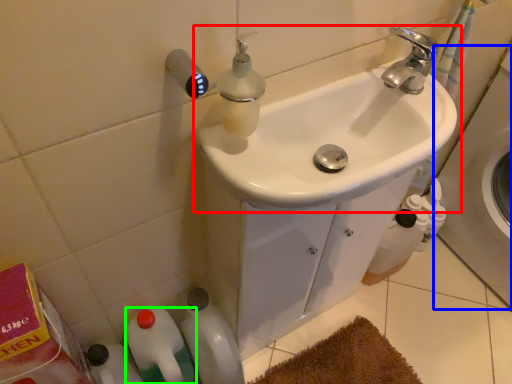
Question: Which object is positioned closest to sink (highlighted by a red box)? Select from bath (highlighted by a blue box) and bottle (highlighted by a green box).

Choices:
 (A) bath
 (B) bottle

Answer: (B)